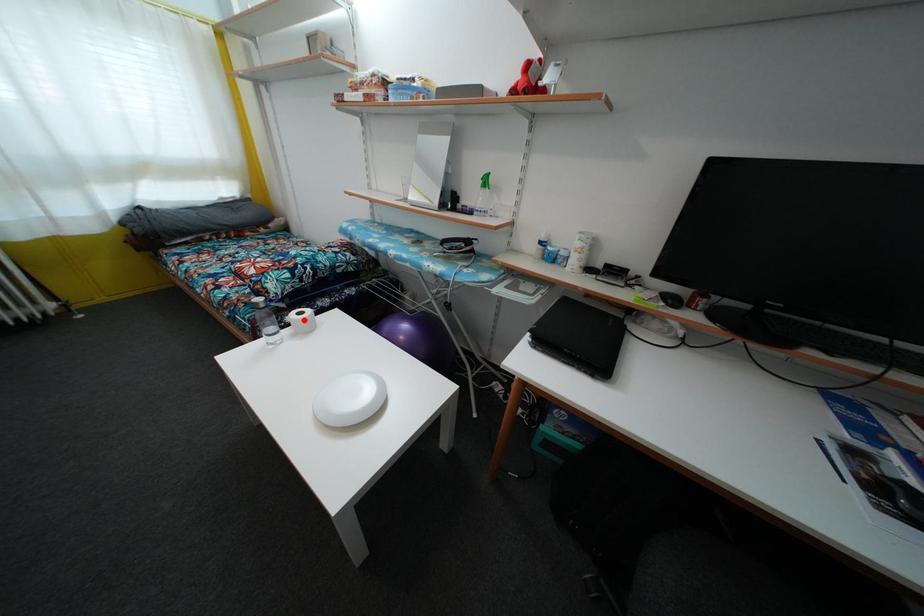
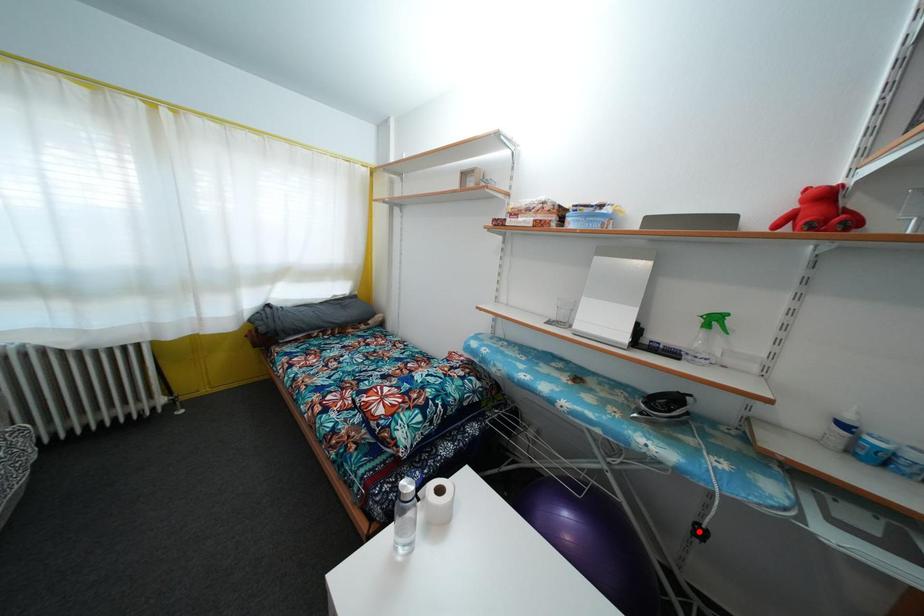
I am providing you with two images of the same scene from different viewpoints. A red point is marked on the first image and another point is marked on the second image. Is the marked point in image1 the same physical position as the marked point in image2?

No